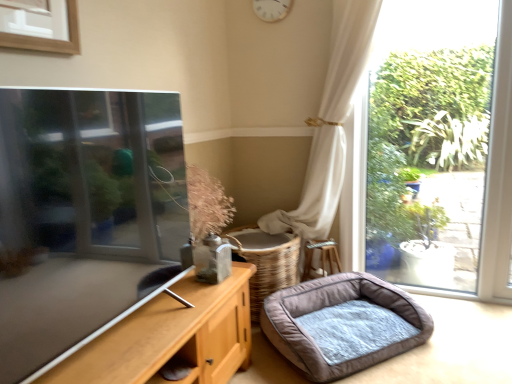
At what (x,y) coordinates should I click in order to perform the action: click on vacant area that lies to the right of gray plush dog bed at lower right. Please return your answer as a coordinate pair (x, y). This screenshot has height=384, width=512. Looking at the image, I should click on (466, 334).